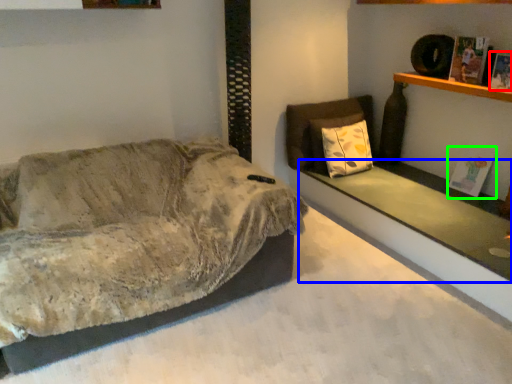
Question: Which object is positioned closest to magazine (highlighted by a red box)? Select from ledge (highlighted by a blue box) and magazine (highlighted by a green box).

Choices:
 (A) ledge
 (B) magazine

Answer: (B)